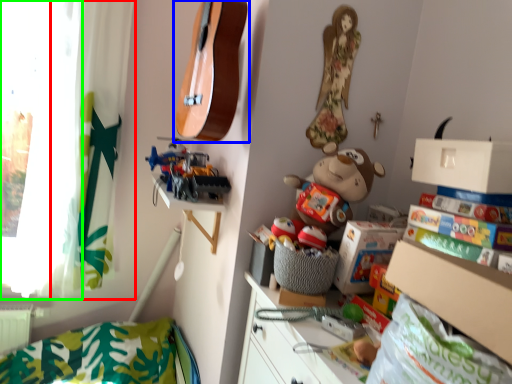
Question: Estimate the real-world distances between objects in this image. Which object is farther from curtain (highlighted by a red box), guitar (highlighted by a blue box) or window screen (highlighted by a green box)?

Choices:
 (A) guitar
 (B) window screen

Answer: (A)